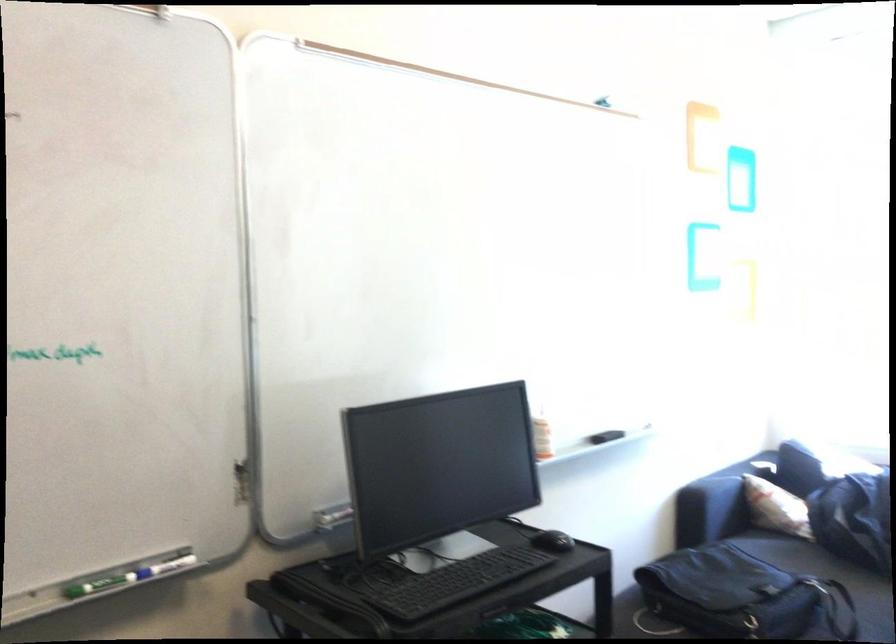
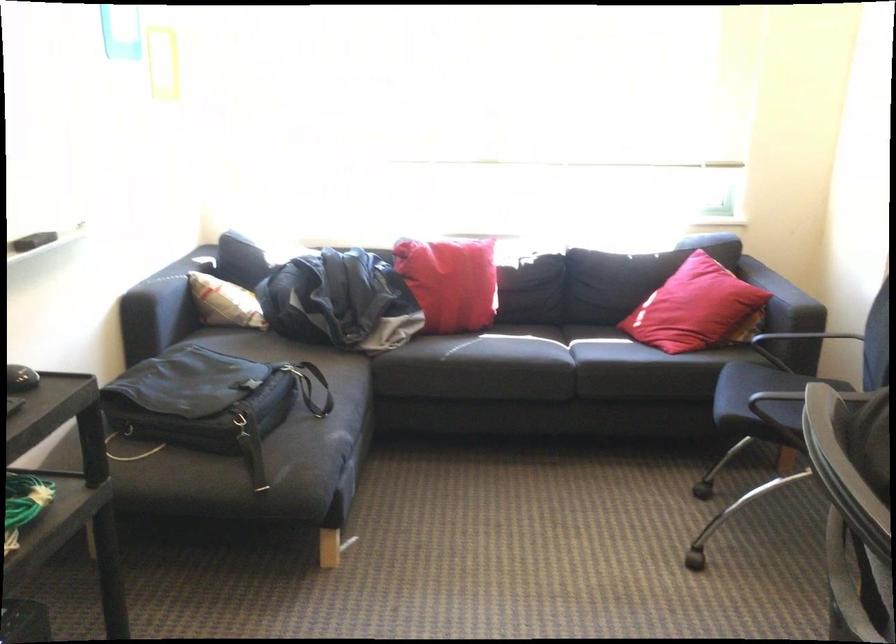
Question: I am providing you with two images of the same scene from different viewpoints. After the viewpoint changes to image2, which objects are now occluded?

Choices:
 (A) yellow candy box
 (B) dark sofa armrest
 (C) red square pillow
 (D) sofa sitting surface

Answer: (D)